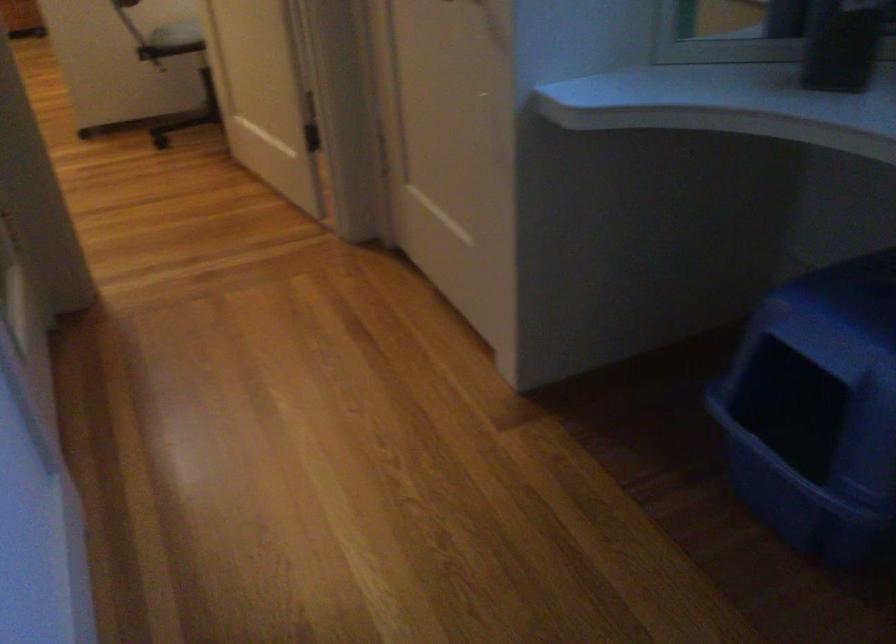
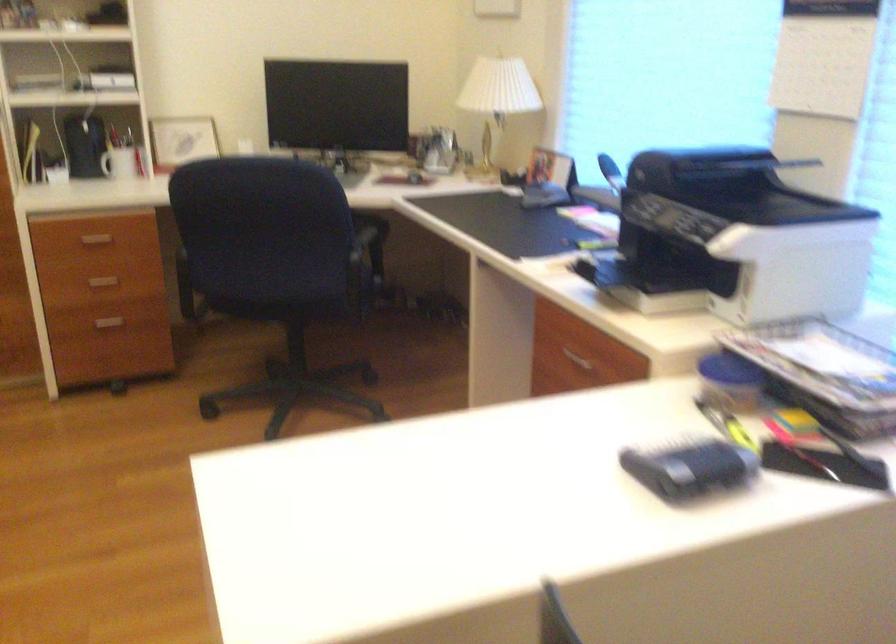
What movement of the cameraman would produce the second image?

The movement direction of the cameraman is left, forward.